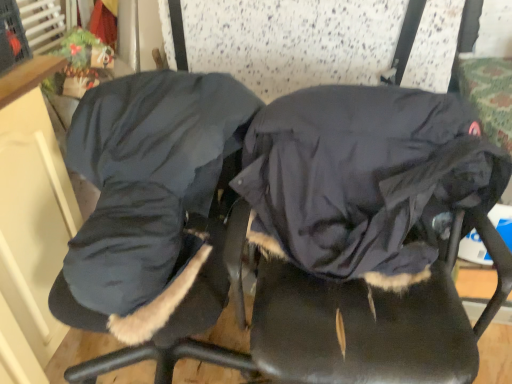
Question: Is dark gray fabric coat at center closer to camera compared to velvet-like dark blue coat at center?

Choices:
 (A) yes
 (B) no

Answer: (B)

Question: Is dark gray fabric coat at center bigger than velvet-like dark blue coat at center?

Choices:
 (A) yes
 (B) no

Answer: (B)

Question: Is dark gray fabric coat at center oriented away from velvet-like dark blue coat at center?

Choices:
 (A) no
 (B) yes

Answer: (A)

Question: Does dark gray fabric coat at center lie behind velvet-like dark blue coat at center?

Choices:
 (A) yes
 (B) no

Answer: (A)

Question: Does dark gray fabric coat at center have a smaller size compared to velvet-like dark blue coat at center?

Choices:
 (A) no
 (B) yes

Answer: (B)

Question: From a real-world perspective, is dark gray fabric coat at center physically above velvet-like dark blue coat at center?

Choices:
 (A) yes
 (B) no

Answer: (A)

Question: Does velvet-like dark blue coat at center have a lesser width compared to dark blue fleece sleeping bag at center?

Choices:
 (A) no
 (B) yes

Answer: (A)

Question: From a real-world perspective, does velvet-like dark blue coat at center stand above dark blue fleece sleeping bag at center?

Choices:
 (A) no
 (B) yes

Answer: (A)

Question: Can you confirm if velvet-like dark blue coat at center is taller than dark blue fleece sleeping bag at center?

Choices:
 (A) no
 (B) yes

Answer: (B)

Question: Is velvet-like dark blue coat at center not near dark blue fleece sleeping bag at center?

Choices:
 (A) yes
 (B) no

Answer: (B)

Question: Considering the relative positions of velvet-like dark blue coat at center and dark blue fleece sleeping bag at center in the image provided, is velvet-like dark blue coat at center in front of dark blue fleece sleeping bag at center?

Choices:
 (A) no
 (B) yes

Answer: (B)

Question: From a real-world perspective, is velvet-like dark blue coat at center positioned under dark blue fleece sleeping bag at center based on gravity?

Choices:
 (A) no
 (B) yes

Answer: (B)

Question: Does dark blue fleece sleeping bag at center have a greater width compared to velvet-like dark blue coat at center?

Choices:
 (A) yes
 (B) no

Answer: (B)